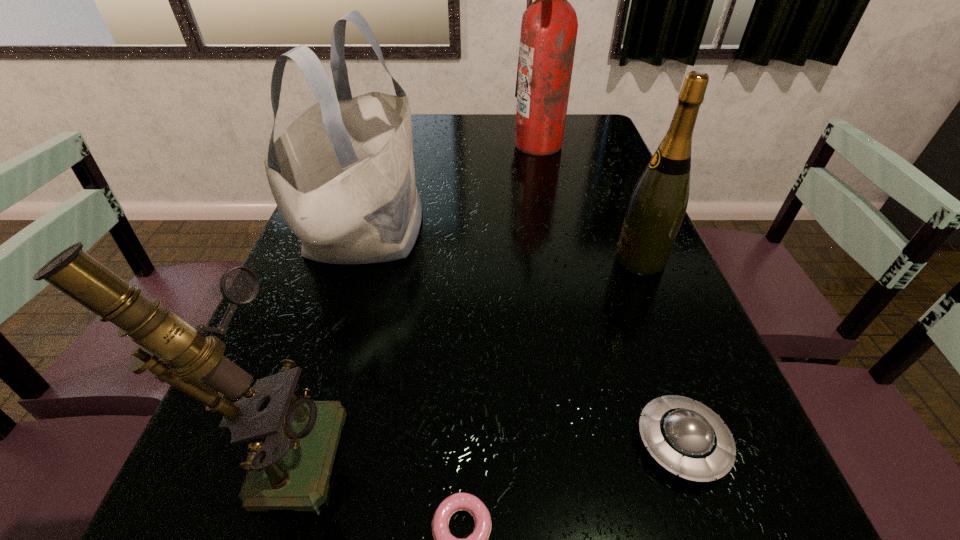
This screenshot has width=960, height=540. I want to click on vacant space that's between the tallest object and the shopping bag, so point(452,187).

Locate an element on the screen. The height and width of the screenshot is (540, 960). free area in between the wine bottle and the fire extinguisher is located at coordinates (589, 202).

Find the location of a particular element. Image resolution: width=960 pixels, height=540 pixels. the third closest object to the shortest object is located at coordinates (342, 174).

Where is `the second closest object to the microscope`? The image size is (960, 540). the second closest object to the microscope is located at coordinates (342, 174).